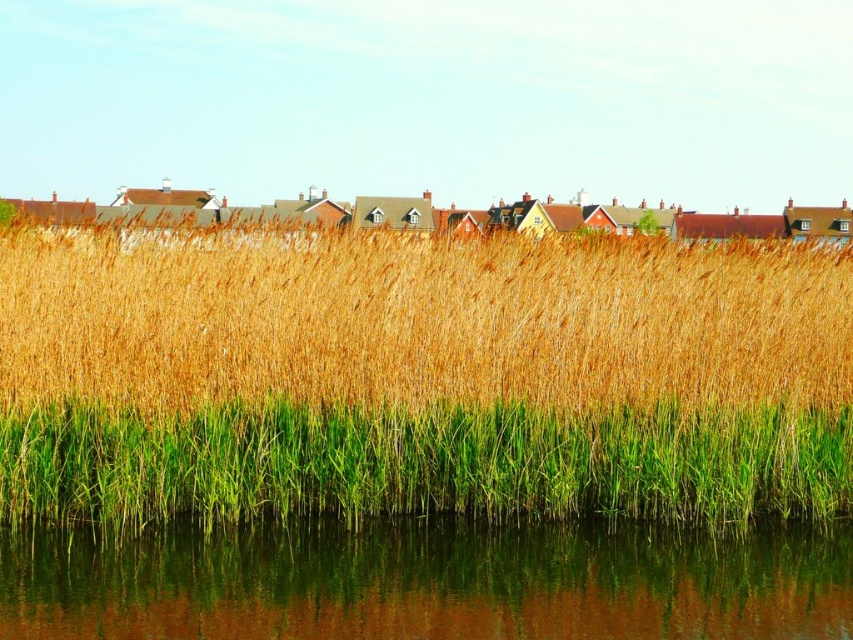
How much distance is there between golden grass at center and green reflective water at lower center?

They are 5.52 meters apart.

Does golden grass at center appear over green reflective water at lower center?

Correct, golden grass at center is located above green reflective water at lower center.

Between point (489, 385) and point (36, 632), which one is positioned in front?

Point (36, 632) is more forward.

I want to click on golden grass at center, so click(x=418, y=320).

Does green grass at lower center appear over green reflective water at lower center?

Indeed, green grass at lower center is positioned over green reflective water at lower center.

What do you see at coordinates (421, 461) in the screenshot? I see `green grass at lower center` at bounding box center [421, 461].

Find the location of a particular element. This screenshot has height=640, width=853. green grass at lower center is located at coordinates (421, 461).

Is golden grass at center positioned behind green grass at lower center?

No, golden grass at center is in front of green grass at lower center.

Between golden grass at center and green grass at lower center, which one has less height?

green grass at lower center

What are the coordinates of `golden grass at center` in the screenshot? It's located at (418, 320).